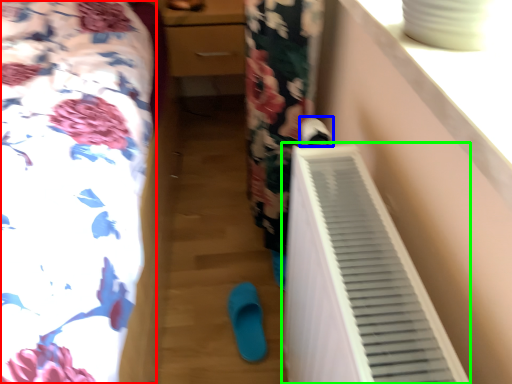
Question: Which object is positioned farthest from furniture (highlighted by a red box)? Select from footwear (highlighted by a blue box) and air conditioning (highlighted by a green box).

Choices:
 (A) footwear
 (B) air conditioning

Answer: (A)